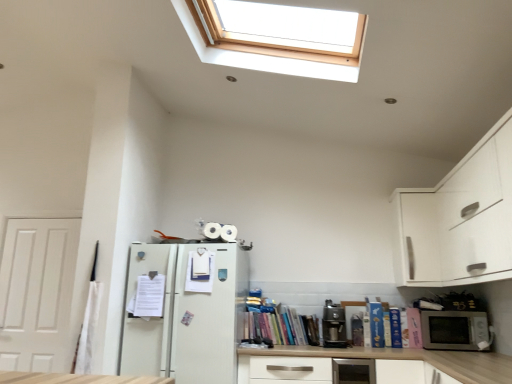
Locate an element on the screen. empty space that is ontop of white paper at left, the 1th book positioned from the left (from a real-world perspective) is located at coordinates coord(143,275).